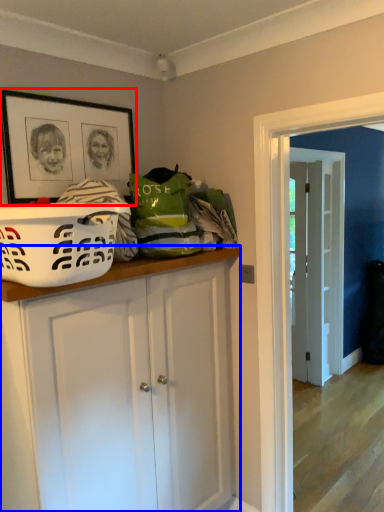
Question: Which point is closer to the camera, picture frame (highlighted by a red box) or cabinetry (highlighted by a blue box)?

Choices:
 (A) picture frame
 (B) cabinetry

Answer: (B)